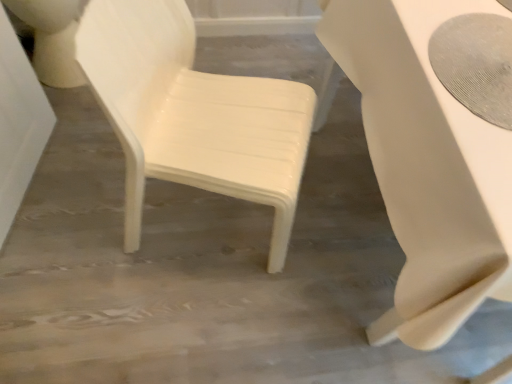
Measure the distance between point (x=253, y=83) and camera.

A distance of 1.24 meters exists between point (x=253, y=83) and camera.

This screenshot has width=512, height=384. What are the coordinates of `white glossy toilet bowl at upper left` in the screenshot? It's located at (52, 39).

Locate an element on the screen. This screenshot has height=384, width=512. white glossy chair at center is located at coordinates (193, 114).

Is white glossy toilet bowl at upper left turned away from white glossy chair at center?

No, white glossy chair at center is not at the back of white glossy toilet bowl at upper left.

Which object is further away from the camera, white glossy toilet bowl at upper left or white glossy chair at center?

white glossy toilet bowl at upper left is further away from the camera.

Is white glossy toilet bowl at upper left not inside white glossy chair at center?

Yes.

Who is taller, white glossy table at right or white glossy chair at center?

white glossy chair at center is taller.

What are the coordinates of `chair that is on the left side of white glossy table at right` in the screenshot? It's located at (193, 114).

Is white glossy table at right directly adjacent to white glossy chair at center?

white glossy table at right and white glossy chair at center are not in contact.

How many degrees apart are the facing directions of white glossy table at right and white glossy chair at center?

The angular difference between white glossy table at right and white glossy chair at center is 69.4 degrees.

Between white glossy chair at center and white glossy toilet bowl at upper left, which one has less height?

Standing shorter between the two is white glossy toilet bowl at upper left.

From a real-world perspective, which object stands above the other?

In real-world perspective, white glossy chair at center is above.

Between white glossy chair at center and white glossy toilet bowl at upper left, which one appears on the right side from the viewer's perspective?

From the viewer's perspective, white glossy chair at center appears more on the right side.

Which is correct: white glossy chair at center is inside white glossy table at right, or outside of it?

white glossy chair at center is outside white glossy table at right.

Considering the sizes of objects white glossy chair at center and white glossy table at right in the image provided, who is taller, white glossy chair at center or white glossy table at right?

white glossy chair at center is taller.

From a real-world perspective, is white glossy chair at center over white glossy table at right?

Yes.

Is white glossy chair at center far from white glossy table at right?

Actually, white glossy chair at center and white glossy table at right are a little close together.

Does white glossy table at right turn towards white glossy toilet bowl at upper left?

No, white glossy table at right is not aimed at white glossy toilet bowl at upper left.

Between white glossy table at right and white glossy toilet bowl at upper left, which one is positioned behind?

Positioned behind is white glossy toilet bowl at upper left.

From a real-world perspective, is white glossy table at right below white glossy toilet bowl at upper left?

No, from a real-world perspective, white glossy table at right is not below white glossy toilet bowl at upper left.

Based on the photo, between white glossy toilet bowl at upper left and white glossy table at right, which one has smaller size?

With smaller size is white glossy toilet bowl at upper left.

How much distance is there between white glossy toilet bowl at upper left and white glossy table at right?

A distance of 3.69 feet exists between white glossy toilet bowl at upper left and white glossy table at right.

From a real-world perspective, is white glossy toilet bowl at upper left positioned above or below white glossy table at right?

Clearly, from a real-world perspective, white glossy toilet bowl at upper left is below white glossy table at right.

Find the location of a particular element. toilet bowl behind the white glossy chair at center is located at coordinates point(52,39).

Locate an element on the screen. This screenshot has width=512, height=384. table lying in front of the white glossy chair at center is located at coordinates (426, 166).

Estimate the real-world distances between objects in this image. Which object is further from white glossy toilet bowl at upper left, white glossy chair at center or white glossy table at right?

white glossy table at right.

Looking at this image, estimate the real-world distances between objects in this image. Which object is further from white glossy table at right, white glossy toilet bowl at upper left or white glossy chair at center?

white glossy toilet bowl at upper left lies further to white glossy table at right than the other object.

When comparing their distances from white glossy table at right, does white glossy chair at center or white glossy toilet bowl at upper left seem further?

white glossy toilet bowl at upper left.

Which object lies further to the anchor point white glossy toilet bowl at upper left, white glossy table at right or white glossy chair at center?

white glossy table at right lies further to white glossy toilet bowl at upper left than the other object.

Estimate the real-world distances between objects in this image. Which object is closer to white glossy chair at center, white glossy table at right or white glossy toilet bowl at upper left?

white glossy table at right is closer to white glossy chair at center.

In the scene shown: Considering their positions, is white glossy toilet bowl at upper left positioned closer to white glossy chair at center than white glossy table at right?

white glossy table at right lies closer to white glossy chair at center than the other object.

You are a GUI agent. You are given a task and a screenshot of the screen. Output one action in this format:
    pyautogui.click(x=<x>, y=<y>)
    Task: Click on the chair between white glossy toilet bowl at upper left and white glossy table at right
    The image size is (512, 384).
    Given the screenshot: What is the action you would take?
    pyautogui.click(x=193, y=114)